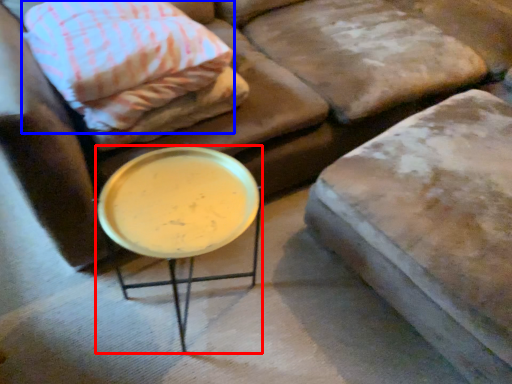
Question: Which point is further to the camera, table (highlighted by a red box) or pillow (highlighted by a blue box)?

Choices:
 (A) table
 (B) pillow

Answer: (B)